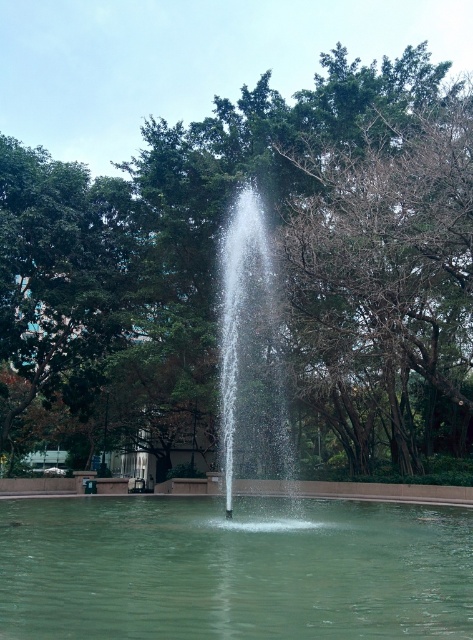
Question: Does green leafy tree at center have a larger size compared to green translucent water at center?

Choices:
 (A) yes
 (B) no

Answer: (A)

Question: Which point is farther to the camera?

Choices:
 (A) (297, 390)
 (B) (276, 336)
 (C) (236, 524)

Answer: (A)

Question: Which of the following is the farthest from the observer?

Choices:
 (A) clear glass fountain at center
 (B) green leafy tree at center
 (C) green translucent water at center

Answer: (B)

Question: From the image, what is the correct spatial relationship of green leafy tree at center in relation to clear glass fountain at center?

Choices:
 (A) right
 (B) left

Answer: (B)

Question: Which point is farther from the camera taking this photo?

Choices:
 (A) (238, 637)
 (B) (268, 333)

Answer: (B)

Question: Is the position of green translucent water at center more distant than that of clear glass fountain at center?

Choices:
 (A) no
 (B) yes

Answer: (A)